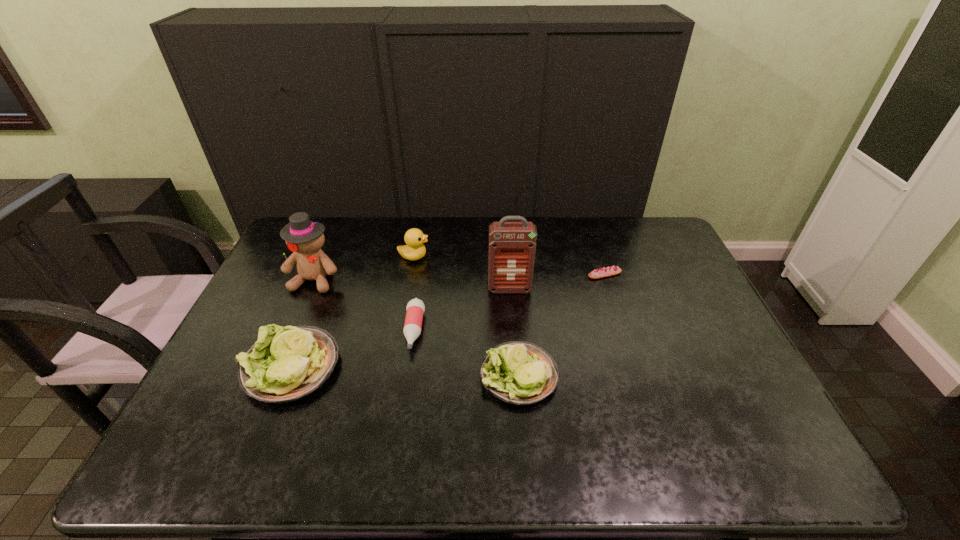
Given the evenly spaced lettuces in the image, where should an extra lettuce be added on the right to preserve the spacing? Please point to a vacant space. Please provide its 2D coordinates. Your answer should be formatted as a tuple, i.e. [(x, y)], where the tuple contains the x and y coordinates of a point satisfying the conditions above.

[(756, 384)]